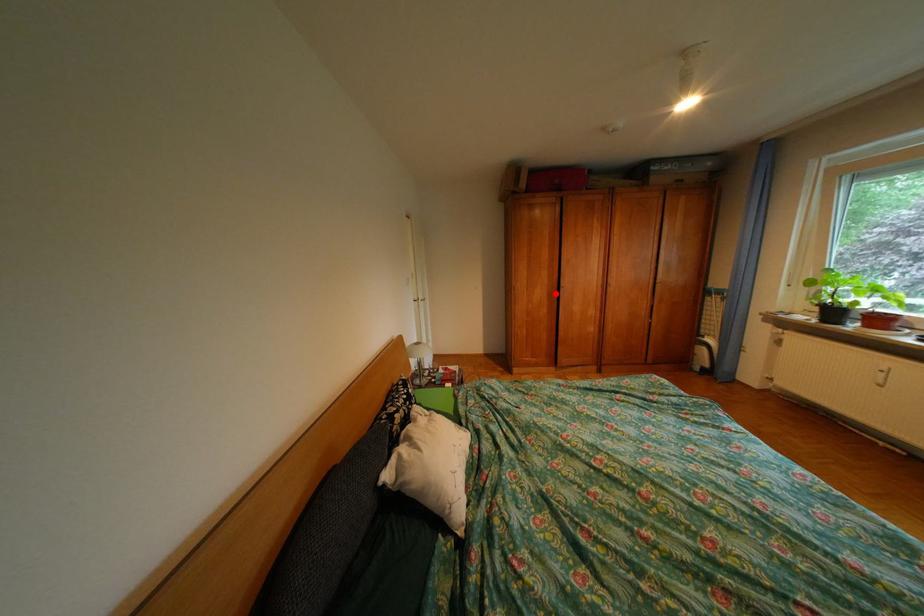
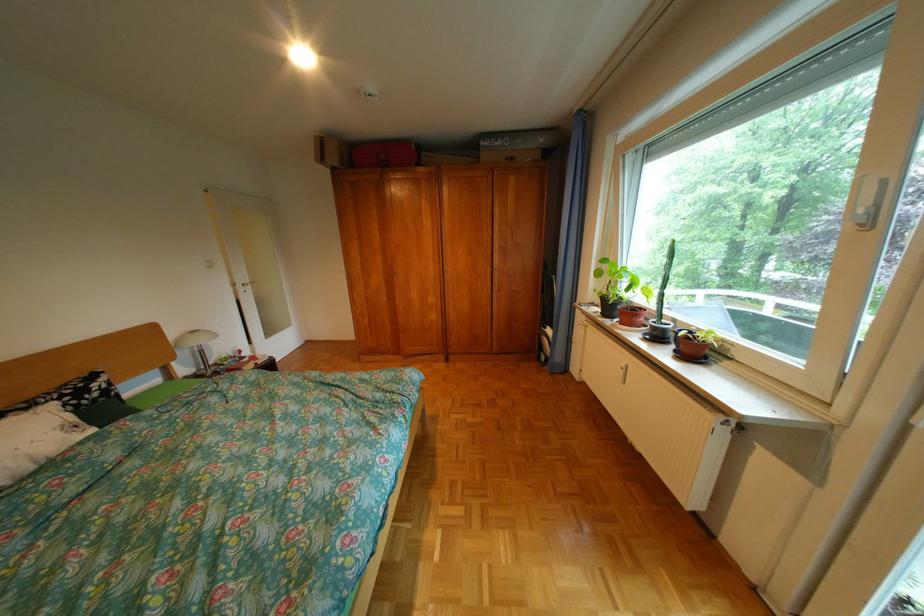
Question: I am providing you with two images of the same scene from different viewpoints. Given a red point in image1, look at the same physical point in image2. Is it:

Choices:
 (A) Closer to the viewpoint
 (B) Farther from the viewpoint

Answer: (A)